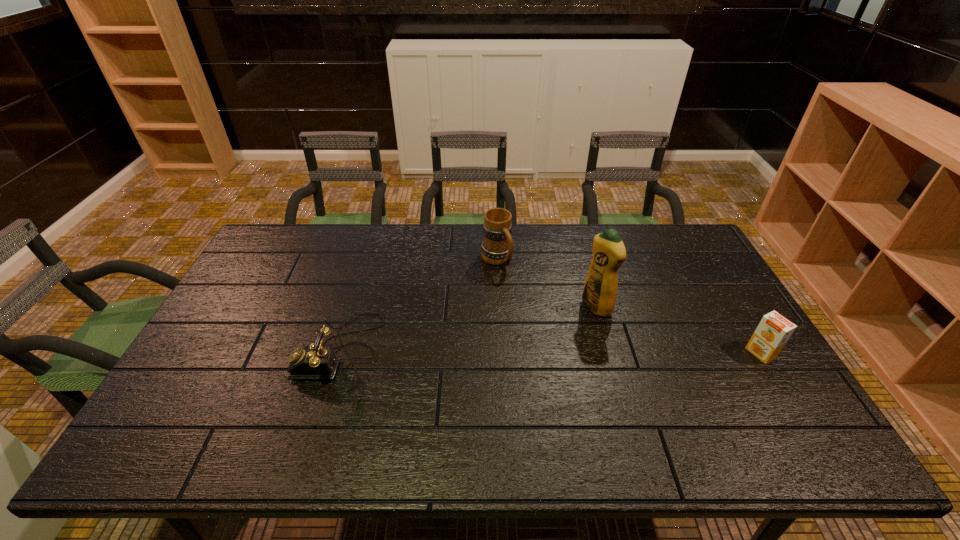
The width and height of the screenshot is (960, 540). In the image, there is a desktop. Identify the location of vacant area at the near edge. (352, 410).

Find the location of a particular element. Image resolution: width=960 pixels, height=540 pixels. vacant space at the left edge of the desktop is located at coordinates (233, 372).

In the image, there is a desktop. Identify the location of free space at the right edge. (718, 289).

Image resolution: width=960 pixels, height=540 pixels. Find the location of `vacant space at the far left corner`. vacant space at the far left corner is located at coordinates (287, 251).

The height and width of the screenshot is (540, 960). Identify the location of vacant region at the far right corner of the desktop. pos(676,243).

At what (x,y) coordinates should I click in order to perform the action: click on vacant space in between the leftmost object and the mug. Please return your answer as a coordinate pair (x, y). Looking at the image, I should click on (419, 304).

This screenshot has width=960, height=540. Identify the location of vacant point located between the farthest object and the detergent. (x=546, y=283).

Find the location of a particular element. The width and height of the screenshot is (960, 540). free space that is in between the rightmost object and the farthest object is located at coordinates (629, 306).

Locate an element on the screen. free space between the second object from left to right and the rightmost object is located at coordinates (629, 306).

Where is `vacant point located between the second tallest object and the orange juice`? This screenshot has width=960, height=540. vacant point located between the second tallest object and the orange juice is located at coordinates (629, 306).